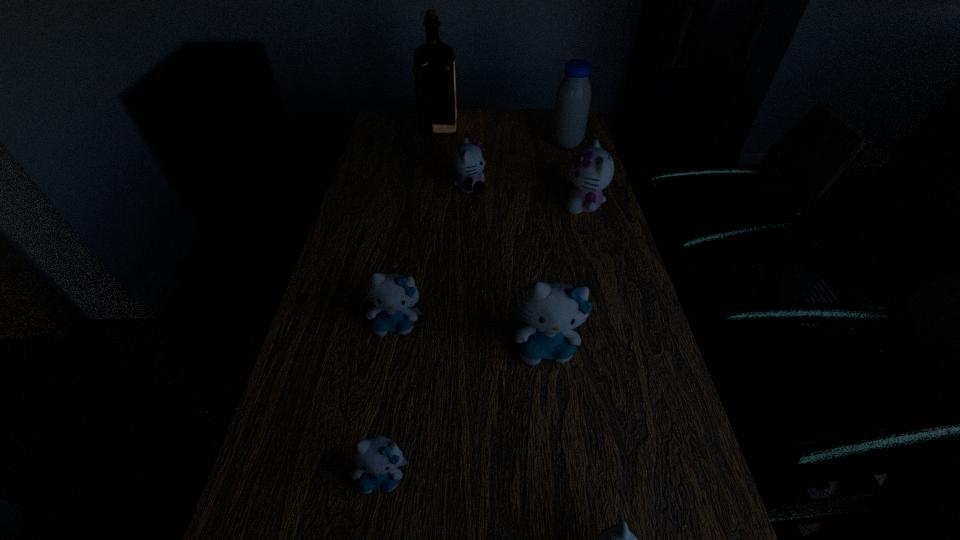
Identify the location of soya milk that is at the far edge. This screenshot has width=960, height=540. [572, 103].

You are a GUI agent. You are given a task and a screenshot of the screen. Output one action in this format:
    pyautogui.click(x=<x>, y=<y>)
    Task: Click on the liquor that is positioned at the left edge
    This screenshot has width=960, height=540.
    Given the screenshot: What is the action you would take?
    pyautogui.click(x=434, y=61)

At what (x,y) coordinates should I click in order to perform the action: click on soya milk located in the right edge section of the desktop. Please return your answer as a coordinate pair (x, y). This screenshot has width=960, height=540. Looking at the image, I should click on (572, 103).

In order to click on object located at the far left corner in this screenshot , I will do `click(434, 61)`.

Locate an element on the screen. object present at the far right corner is located at coordinates (572, 103).

Where is `vacant space at the far edge of the desktop`? The width and height of the screenshot is (960, 540). vacant space at the far edge of the desktop is located at coordinates (473, 123).

What are the coordinates of `vacant space at the left edge` in the screenshot? It's located at (410, 142).

Identify the location of free point at the right edge. The image size is (960, 540). (622, 298).

I want to click on free region at the far left corner of the desktop, so click(396, 127).

In order to click on vacant space at the far right corner of the desktop in this screenshot , I will do `click(544, 129)`.